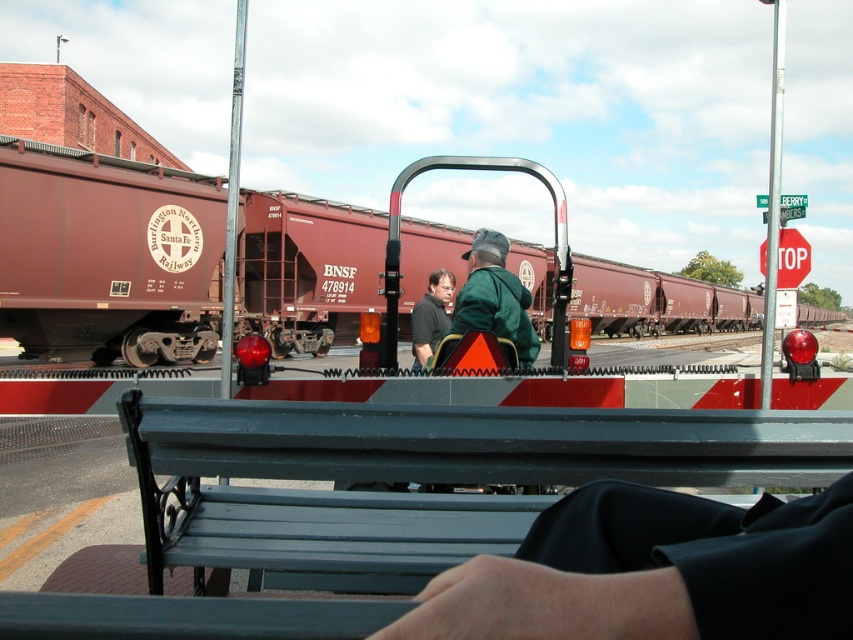
Question: Is metallic gray bench at center below matte black shirt at center?

Choices:
 (A) no
 (B) yes

Answer: (B)

Question: Considering the relative positions of maroon matte freight car at center and red plastic stop sign at upper right in the image provided, where is maroon matte freight car at center located with respect to red plastic stop sign at upper right?

Choices:
 (A) below
 (B) above

Answer: (A)

Question: Estimate the real-world distances between objects in this image. Which object is closer to the metallic gray bench at center?

Choices:
 (A) dark green fabric at center
 (B) matte black shirt at center
 (C) maroon matte freight car at center
 (D) red plastic stop sign at upper right

Answer: (A)

Question: Which object appears closest to the camera in this image?

Choices:
 (A) metallic gray bench at center
 (B) green matte jacket at center

Answer: (A)

Question: Can you confirm if maroon matte freight car at center is smaller than matte black shirt at center?

Choices:
 (A) yes
 (B) no

Answer: (B)

Question: Among these points, which one is farthest from the camera?

Choices:
 (A) (637, 513)
 (B) (786, 262)
 (C) (178, 436)

Answer: (B)